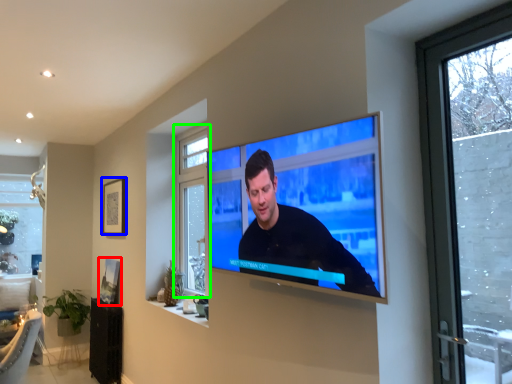
Question: Considering the real-world distances, which object is farthest from picture frame (highlighted by a red box)? picture frame (highlighted by a blue box) or window (highlighted by a green box)?

Choices:
 (A) picture frame
 (B) window

Answer: (B)